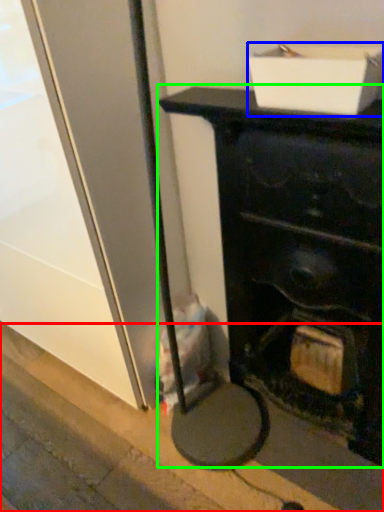
Question: Which object is positioned farthest from pavement (highlighted by a red box)? Select from cardboard box (highlighted by a blue box) and furniture (highlighted by a green box).

Choices:
 (A) cardboard box
 (B) furniture

Answer: (A)